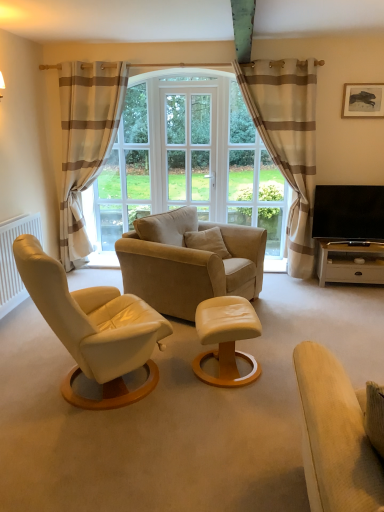
Question: Can you see beige striped curtain at left, placed as the 1th curtain when sorted from left to right, touching black glossy tv at right?

Choices:
 (A) yes
 (B) no

Answer: (B)

Question: Does beige striped curtain at left, placed as the 1th curtain when sorted from left to right, come behind black glossy tv at right?

Choices:
 (A) yes
 (B) no

Answer: (A)

Question: Is beige striped curtain at left, which appears as the 2th curtain when viewed from the right, closer to the viewer compared to black glossy tv at right?

Choices:
 (A) no
 (B) yes

Answer: (A)

Question: From the image's perspective, is beige striped curtain at left, which appears as the 2th curtain when viewed from the right, on top of black glossy tv at right?

Choices:
 (A) yes
 (B) no

Answer: (A)

Question: Is black glossy tv at right located within beige striped curtain at left, which appears as the 2th curtain when viewed from the right?

Choices:
 (A) yes
 (B) no

Answer: (B)

Question: Considering the relative sizes of beige striped curtain at left, placed as the 1th curtain when sorted from left to right, and black glossy tv at right in the image provided, is beige striped curtain at left, placed as the 1th curtain when sorted from left to right, taller than black glossy tv at right?

Choices:
 (A) yes
 (B) no

Answer: (A)

Question: Is light beige fabric studio couch at lower right taller than white glossy table at right, positioned as the second table in bottom-to-top order?

Choices:
 (A) yes
 (B) no

Answer: (A)

Question: Is light beige fabric studio couch at lower right shorter than white glossy table at right, which ranks as the first table in right-to-left order?

Choices:
 (A) yes
 (B) no

Answer: (B)

Question: Is light beige fabric studio couch at lower right at the right side of white glossy table at right, positioned as the second table in bottom-to-top order?

Choices:
 (A) no
 (B) yes

Answer: (A)

Question: Can you confirm if light beige fabric studio couch at lower right is thinner than white glossy table at right, positioned as the second table in bottom-to-top order?

Choices:
 (A) yes
 (B) no

Answer: (B)

Question: Is light beige fabric studio couch at lower right in front of white glossy table at right, positioned as the second table in bottom-to-top order?

Choices:
 (A) no
 (B) yes

Answer: (B)

Question: Is light beige fabric studio couch at lower right not near white glossy table at right, which is counted as the first table, starting from the top?

Choices:
 (A) yes
 (B) no

Answer: (A)

Question: From a real-world perspective, does clear glass window at center sit lower than matte leather ottoman at center, which is the 1th table in left-to-right order?

Choices:
 (A) yes
 (B) no

Answer: (B)